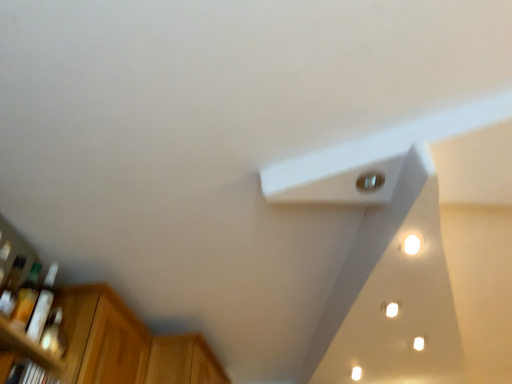
This screenshot has width=512, height=384. What do you see at coordinates (392, 295) in the screenshot?
I see `white matte exhaust hood at upper center` at bounding box center [392, 295].

The image size is (512, 384). What do you see at coordinates (26, 298) in the screenshot?
I see `translucent glass bottle at lower left, which appears as the 2th bottle when viewed from the front` at bounding box center [26, 298].

Locate an element on the screen. The height and width of the screenshot is (384, 512). metallic silver light at upper right, the 1th light viewed from the top is located at coordinates (370, 181).

Find the location of `translucent glass bottle at left, marked as the 1th bottle in a front-to-back arrangement`. translucent glass bottle at left, marked as the 1th bottle in a front-to-back arrangement is located at coordinates (11, 287).

You are a GUI agent. You are given a task and a screenshot of the screen. Output one action in this format:
    pyautogui.click(x=<x>, y=<y>)
    Task: Click on the white glossy light at upper right, which is counted as the first light, starting from the back
    This screenshot has width=512, height=384.
    Given the screenshot: What is the action you would take?
    pyautogui.click(x=412, y=244)

Where is `white matte exhaust hood at upper center`? The image size is (512, 384). white matte exhaust hood at upper center is located at coordinates (392, 295).

Between point (359, 239) and point (13, 269), which one is positioned behind?

Positioned behind is point (359, 239).

Is white matte exhaust hood at upper center facing away from translucent glass bottle at left, marked as the 1th bottle in a front-to-back arrangement?

No, white matte exhaust hood at upper center is not facing the opposite direction of translucent glass bottle at left, marked as the 1th bottle in a front-to-back arrangement.

Which is more to the left, translucent plastic bottle at left, the 3th bottle when ordered from front to back, or translucent glass bottle at lower left, which appears as the 2th bottle when viewed from the front?

From the viewer's perspective, translucent glass bottle at lower left, which appears as the 2th bottle when viewed from the front, appears more on the left side.

Does translucent plastic bottle at left, the 1th bottle from the back, turn towards translucent glass bottle at lower left, which appears as the 2th bottle when viewed from the front?

No, translucent plastic bottle at left, the 1th bottle from the back, is not aimed at translucent glass bottle at lower left, which appears as the 2th bottle when viewed from the front.

Is translucent plastic bottle at left, the 1th bottle from the back, positioned beyond the bounds of translucent glass bottle at lower left, which is the 2th bottle from back to front?

Yes, translucent plastic bottle at left, the 1th bottle from the back, is located beyond the bounds of translucent glass bottle at lower left, which is the 2th bottle from back to front.

Can you confirm if translucent plastic bottle at left, the 1th bottle from the back, is shorter than translucent glass bottle at lower left, which appears as the 2th bottle when viewed from the front?

Incorrect, the height of translucent plastic bottle at left, the 1th bottle from the back, does not fall short of that of translucent glass bottle at lower left, which appears as the 2th bottle when viewed from the front.

Is translucent glass bottle at left, marked as the 1th bottle in a front-to-back arrangement, touching translucent glass bottle at lower left, which appears as the 2th bottle when viewed from the front?

Yes, translucent glass bottle at left, marked as the 1th bottle in a front-to-back arrangement, is beside translucent glass bottle at lower left, which appears as the 2th bottle when viewed from the front.

Can you confirm if translucent glass bottle at left, marked as the 1th bottle in a front-to-back arrangement, is smaller than translucent glass bottle at lower left, which appears as the 2th bottle when viewed from the front?

Yes.

Identify the location of the 1st bottle behind the translucent glass bottle at left, marked as the 1th bottle in a front-to-back arrangement. (26, 298).

From a real-world perspective, is translucent glass bottle at left, the 3th bottle viewed from the back, over translucent glass bottle at lower left, which appears as the 2th bottle when viewed from the front?

No, from a real-world perspective, translucent glass bottle at left, the 3th bottle viewed from the back, is not on top of translucent glass bottle at lower left, which appears as the 2th bottle when viewed from the front.

From a real-world perspective, which is physically above, white matte exhaust hood at upper center or translucent glass bottle at lower left, which appears as the 2th bottle when viewed from the front?

white matte exhaust hood at upper center.

What's the angular difference between white matte exhaust hood at upper center and translucent glass bottle at lower left, which is the 2th bottle from back to front,'s facing directions?

The facing directions of white matte exhaust hood at upper center and translucent glass bottle at lower left, which is the 2th bottle from back to front, are 89.5 degrees apart.

There is a white matte exhaust hood at upper center. Identify the location of the 2nd bottle above it (from the image's perspective). (26, 298).

Which object is wider, wooden cabinet at lower left or translucent glass bottle at lower left, which appears as the 2th bottle when viewed from the front?

Wider between the two is wooden cabinet at lower left.

Is point (222, 381) closer to camera compared to point (31, 299)?

No, it is behind (31, 299).

Does wooden cabinet at lower left have a larger size compared to translucent glass bottle at lower left, which is the 2th bottle from back to front?

Yes.

Looking at this image, from a real-world perspective, is wooden cabinet at lower left physically below translucent glass bottle at lower left, which is the 2th bottle from back to front?

Actually, wooden cabinet at lower left is physically above translucent glass bottle at lower left, which is the 2th bottle from back to front, in the real world.

From a real-world perspective, is wooden cabinet at lower left located higher than metallic silver light at upper right, which is the second light in bottom-to-top order?

No, from a real-world perspective, wooden cabinet at lower left is not above metallic silver light at upper right, which is the second light in bottom-to-top order.

Looking at the image, does wooden cabinet at lower left seem bigger or smaller compared to metallic silver light at upper right, the first light in the front-to-back sequence?

wooden cabinet at lower left is bigger than metallic silver light at upper right, the first light in the front-to-back sequence.

Based on the photo, from the image's perspective, relative to metallic silver light at upper right, the second light positioned from the right, is wooden cabinet at lower left above or below?

Based on their image positions, wooden cabinet at lower left is located beneath metallic silver light at upper right, the second light positioned from the right.

Is wooden cabinet at lower left positioned with its back to metallic silver light at upper right, which is the second light in bottom-to-top order?

No.

Which object is wider, translucent plastic bottle at left, the 1th bottle from the back, or wooden cabinet at lower left?

wooden cabinet at lower left is wider.

Is translucent plastic bottle at left, the 3th bottle when ordered from front to back, facing away from wooden cabinet at lower left?

translucent plastic bottle at left, the 3th bottle when ordered from front to back, is not turned away from wooden cabinet at lower left.

Considering the sizes of objects translucent plastic bottle at left, the 1th bottle from the back, and wooden cabinet at lower left in the image provided, who is smaller, translucent plastic bottle at left, the 1th bottle from the back, or wooden cabinet at lower left?

With smaller size is translucent plastic bottle at left, the 1th bottle from the back.

From a real-world perspective, who is located higher, translucent plastic bottle at left, the 1th bottle from the back, or wooden cabinet at lower left?

wooden cabinet at lower left is physically above.

Find the location of a particular element. exhaust hood in front of the translucent glass bottle at left, marked as the 1th bottle in a front-to-back arrangement is located at coordinates (392, 295).

Where is `bottle that is below the translucent glass bottle at lower left, which appears as the 2th bottle when viewed from the front (from the image's perspective)`? The height and width of the screenshot is (384, 512). bottle that is below the translucent glass bottle at lower left, which appears as the 2th bottle when viewed from the front (from the image's perspective) is located at coordinates (42, 305).

In the scene shown: When comparing their distances from white glossy light at upper right, the 2th light positioned from the front, does translucent glass bottle at lower left, which is the 2th bottle from back to front, or metallic silver light at upper right, which is the second light in bottom-to-top order, seem further?

Among the two, translucent glass bottle at lower left, which is the 2th bottle from back to front, is located further to white glossy light at upper right, the 2th light positioned from the front.

From the image, which object appears to be farther from white glossy light at upper right, the 2th light positioned from the front, translucent glass bottle at left, marked as the 1th bottle in a front-to-back arrangement, or translucent plastic bottle at left, the 3th bottle when ordered from front to back?

translucent glass bottle at left, marked as the 1th bottle in a front-to-back arrangement.

Which object lies nearer to the anchor point translucent glass bottle at left, marked as the 1th bottle in a front-to-back arrangement, white glossy light at upper right, which is counted as the first light, starting from the back, or metallic silver light at upper right, the first light in the front-to-back sequence?

metallic silver light at upper right, the first light in the front-to-back sequence, lies closer to translucent glass bottle at left, marked as the 1th bottle in a front-to-back arrangement, than the other object.

Looking at the image, which one is located further to white glossy light at upper right, arranged as the 1th light when viewed from the right, metallic silver light at upper right, the second light positioned from the back, or translucent glass bottle at lower left, which is the 2th bottle from back to front?

Based on the image, translucent glass bottle at lower left, which is the 2th bottle from back to front, appears to be further to white glossy light at upper right, arranged as the 1th light when viewed from the right.

Based on their spatial positions, is translucent plastic bottle at left, the 1th bottle from the back, or metallic silver light at upper right, the first light in the front-to-back sequence, closer to wooden cabinet at lower left?

translucent plastic bottle at left, the 1th bottle from the back, is closer to wooden cabinet at lower left.

When comparing their distances from wooden cabinet at lower left, does translucent glass bottle at lower left, which appears as the 2th bottle when viewed from the front, or white glossy light at upper right, which is the second light from top to bottom, seem further?

white glossy light at upper right, which is the second light from top to bottom, lies further to wooden cabinet at lower left than the other object.

Considering their positions, is translucent glass bottle at lower left, which appears as the 2th bottle when viewed from the front, positioned further to wooden cabinet at lower left than translucent plastic bottle at left, the 3th bottle when ordered from front to back?

translucent glass bottle at lower left, which appears as the 2th bottle when viewed from the front, is positioned further to the anchor wooden cabinet at lower left.

Considering their positions, is white matte exhaust hood at upper center positioned closer to wooden cabinet at lower left than translucent plastic bottle at left, the 1th bottle from the back?

The object closer to wooden cabinet at lower left is translucent plastic bottle at left, the 1th bottle from the back.

At what (x,y) coordinates should I click in order to perform the action: click on bottle between translucent glass bottle at lower left, which is the 2th bottle from back to front, and white glossy light at upper right, which is counted as the first light, starting from the back, in the horizontal direction. Please return your answer as a coordinate pair (x, y). This screenshot has height=384, width=512. Looking at the image, I should click on (42, 305).

Where is `light located between translucent glass bottle at left, the 3th bottle viewed from the back, and white glossy light at upper right, the 2th light positioned from the front, in the left-right direction`? The image size is (512, 384). light located between translucent glass bottle at left, the 3th bottle viewed from the back, and white glossy light at upper right, the 2th light positioned from the front, in the left-right direction is located at coordinates (370, 181).

This screenshot has width=512, height=384. I want to click on bottle between translucent glass bottle at left, marked as the 1th bottle in a front-to-back arrangement, and translucent plastic bottle at left, the 1th bottle from the back, in the front-back direction, so click(x=26, y=298).

Locate an element on the screen. cabinetry situated between translucent glass bottle at left, the 3th bottle viewed from the back, and white glossy light at upper right, arranged as the 1th light when viewed from the right, from left to right is located at coordinates (183, 361).